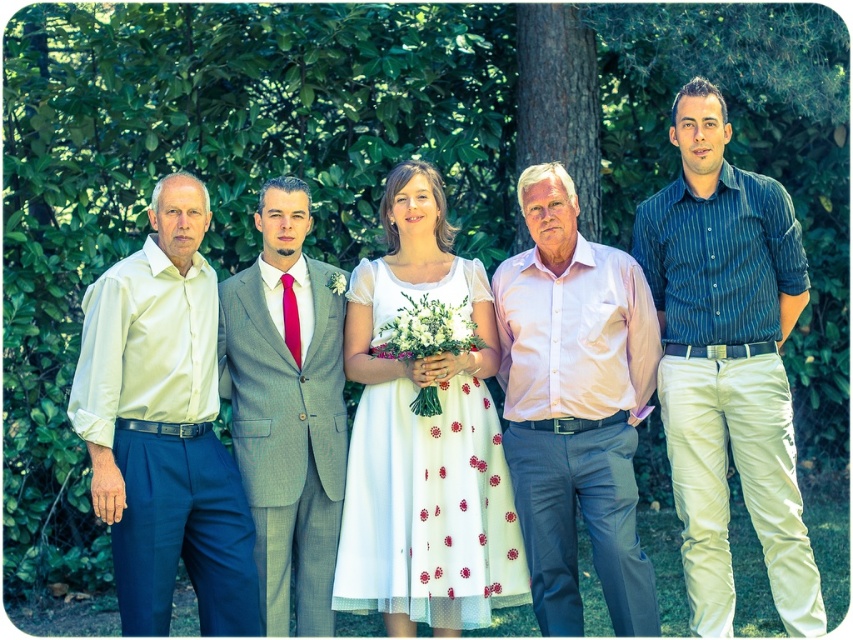
You are a photographer at a wedding and you see the blue striped shirt at center and the gray wool suit at center. Which one is positioned to the right side?

The blue striped shirt at center is positioned to the right of the gray wool suit at center.

You are standing in a garden and see two points marked in the image. The first point is at coordinate point(552,515) and the second is at point(265,556). Which point is closer to you?

Point(552,515) is closer to you than point(265,556).